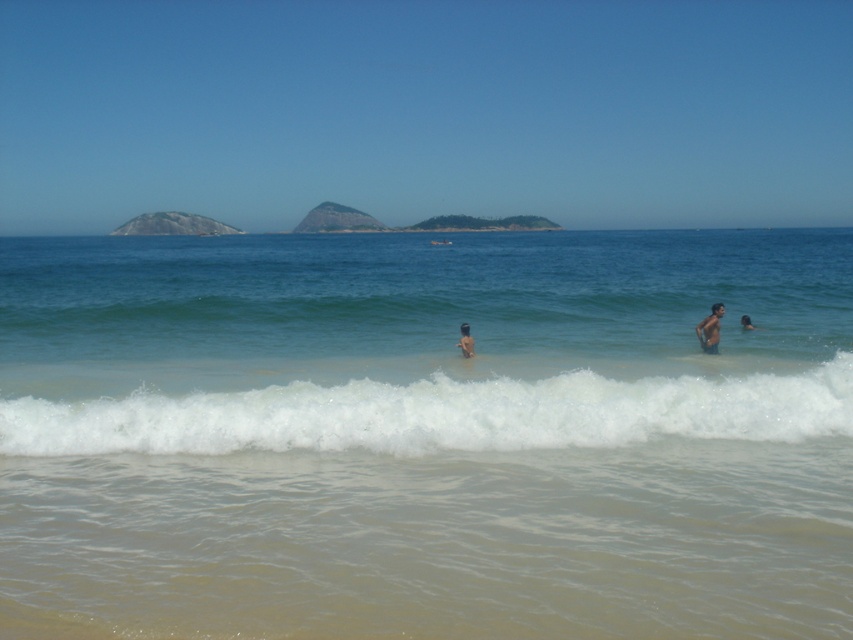
Does white foamy wave at lower center appear over tan skin person at center?

Actually, white foamy wave at lower center is below tan skin person at center.

How much distance is there between white foamy wave at lower center and tan skin person at center?

4.90 meters

Between point (651, 401) and point (463, 340), which one is positioned behind?

Point (463, 340)

Locate an element on the screen. This screenshot has height=640, width=853. white foamy wave at lower center is located at coordinates (439, 413).

Is clear blue water at center closer to the viewer compared to white foamy wave at lower center?

Yes, it is in front of white foamy wave at lower center.

Between clear blue water at center and white foamy wave at lower center, which one is positioned lower?

white foamy wave at lower center

What are the coordinates of `clear blue water at center` in the screenshot? It's located at (425, 435).

You are a GUI agent. You are given a task and a screenshot of the screen. Output one action in this format:
    pyautogui.click(x=<x>, y=<y>)
    Task: Click on the clear blue water at center
    Image resolution: width=853 pixels, height=640 pixels.
    Given the screenshot: What is the action you would take?
    pyautogui.click(x=425, y=435)

Between white foamy wave at lower center and skinny man at right, which one appears on the left side from the viewer's perspective?

From the viewer's perspective, white foamy wave at lower center appears more on the left side.

Between white foamy wave at lower center and skinny man at right, which one is positioned lower?

Positioned lower is white foamy wave at lower center.

Between point (76, 445) and point (749, 323), which one is positioned in front?

Point (76, 445) is in front.

Locate an element on the screen. This screenshot has width=853, height=640. white foamy wave at lower center is located at coordinates (439, 413).